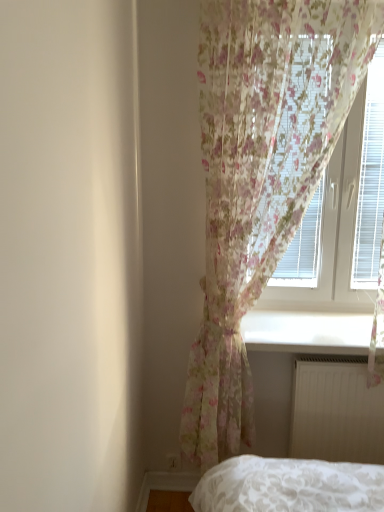
Question: Is translucent floral curtain at upper right positioned beyond the bounds of white smooth window sill at lower center?

Choices:
 (A) no
 (B) yes

Answer: (B)

Question: Is translucent floral curtain at upper right directly adjacent to white smooth window sill at lower center?

Choices:
 (A) yes
 (B) no

Answer: (B)

Question: Is white smooth window sill at lower center inside translucent floral curtain at upper right?

Choices:
 (A) no
 (B) yes

Answer: (A)

Question: From a real-world perspective, is translucent floral curtain at upper right positioned over white smooth window sill at lower center based on gravity?

Choices:
 (A) yes
 (B) no

Answer: (A)

Question: Can you confirm if translucent floral curtain at upper right is thinner than white smooth window sill at lower center?

Choices:
 (A) no
 (B) yes

Answer: (B)

Question: Is translucent floral curtain at upper right at the left side of white smooth window sill at lower center?

Choices:
 (A) yes
 (B) no

Answer: (B)

Question: Is floral sheer curtain at upper right not close to white matte radiator at lower right?

Choices:
 (A) no
 (B) yes

Answer: (A)

Question: From the image's perspective, is floral sheer curtain at upper right on white matte radiator at lower right?

Choices:
 (A) no
 (B) yes

Answer: (B)

Question: Can you confirm if floral sheer curtain at upper right is thinner than white matte radiator at lower right?

Choices:
 (A) yes
 (B) no

Answer: (B)

Question: Can you confirm if floral sheer curtain at upper right is positioned to the left of white matte radiator at lower right?

Choices:
 (A) no
 (B) yes

Answer: (B)

Question: Is white matte radiator at lower right located within floral sheer curtain at upper right?

Choices:
 (A) yes
 (B) no

Answer: (A)

Question: Are floral sheer curtain at upper right and white matte radiator at lower right beside each other?

Choices:
 (A) no
 (B) yes

Answer: (A)

Question: Is white matte radiator at lower right at the back of white smooth window sill at lower center?

Choices:
 (A) no
 (B) yes

Answer: (A)